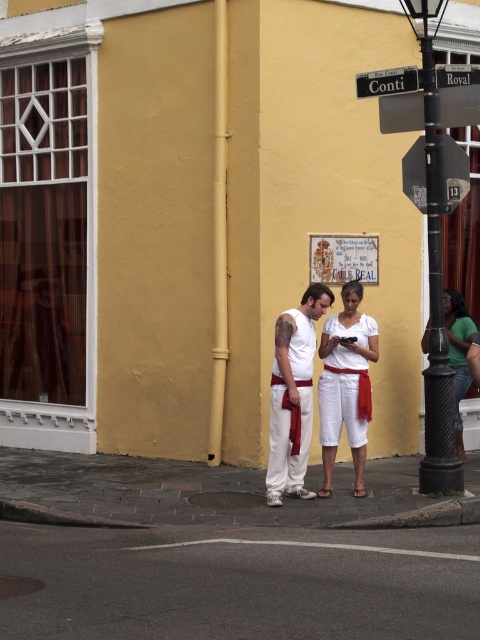
Which is below, white cotton dress at center or black plastic street sign at upper center?

white cotton dress at center is below.

Between white cotton dress at center and black plastic street sign at upper center, which one appears on the right side from the viewer's perspective?

From the viewer's perspective, black plastic street sign at upper center appears more on the right side.

At what (x,y) coordinates should I click in order to perform the action: click on white cotton dress at center. Please return your answer as a coordinate pair (x, y). Looking at the image, I should click on coord(346,385).

Does white matte tank top at center appear under white cotton dress at center?

Correct, white matte tank top at center is located below white cotton dress at center.

Which is in front, point (272, 406) or point (333, 442)?

Point (272, 406) is more forward.

The height and width of the screenshot is (640, 480). Identify the location of white matte tank top at center. (292, 396).

Does black plastic street sign at upper center appear on the left side of metallic street sign at upper center?

Yes, black plastic street sign at upper center is to the left of metallic street sign at upper center.

Consider the image. Is black plastic street sign at upper center below metallic street sign at upper center?

Yes, black plastic street sign at upper center is below metallic street sign at upper center.

Locate an element on the screen. The height and width of the screenshot is (640, 480). black plastic street sign at upper center is located at coordinates (386, 81).

The image size is (480, 640). What are the coordinates of `black plastic street sign at upper center` in the screenshot? It's located at (386, 81).